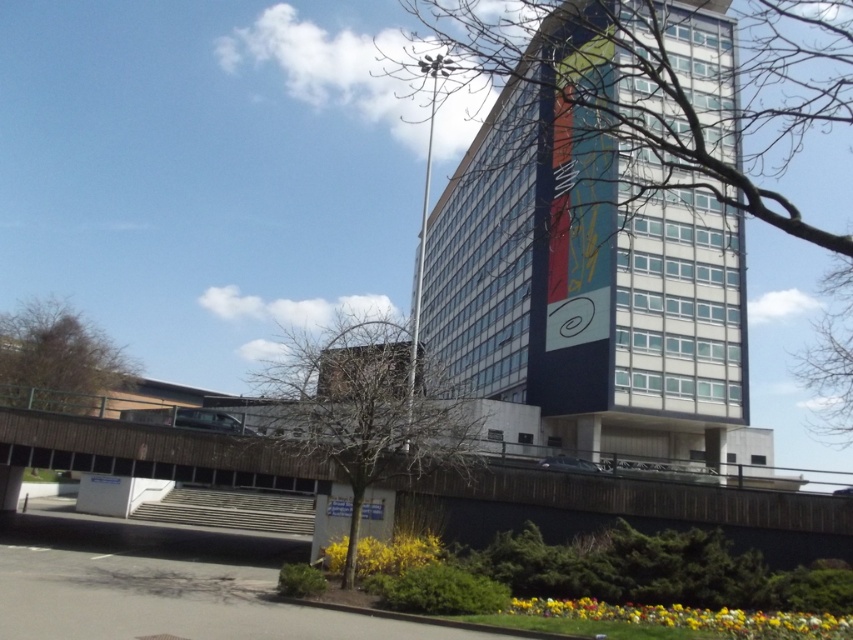
You are standing in front of the building and want to take a photo that includes both the bare branches at upper right and the brown textured tree at lower left. Which object should you position closer to the right side of the frame to ensure both are visible?

You should position the brown textured tree at lower left closer to the right side of the frame because the bare branches at upper right is to the right of it, ensuring both objects are within the frame.

You are standing in front of the multi story building and looking at the bare branches at upper right and the bare branches at center. Which of these two has a larger size?

The bare branches at upper right has a larger size compared to the bare branches at center.